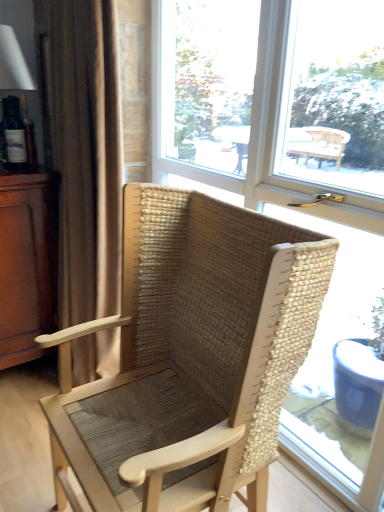
Question: Is transparent glass window at center surrounded by brown fabric curtain at left?

Choices:
 (A) no
 (B) yes

Answer: (A)

Question: Does brown fabric curtain at left have a greater width compared to transparent glass window at center?

Choices:
 (A) no
 (B) yes

Answer: (B)

Question: From a real-world perspective, is brown fabric curtain at left under transparent glass window at center?

Choices:
 (A) yes
 (B) no

Answer: (A)

Question: Considering the relative sizes of brown fabric curtain at left and transparent glass window at center in the image provided, is brown fabric curtain at left bigger than transparent glass window at center?

Choices:
 (A) no
 (B) yes

Answer: (A)

Question: Does brown fabric curtain at left have a greater height compared to transparent glass window at center?

Choices:
 (A) yes
 (B) no

Answer: (A)

Question: Does point (49, 313) appear closer or farther from the camera than point (274, 209)?

Choices:
 (A) closer
 (B) farther

Answer: (B)

Question: From the image's perspective, is brown wood dresser at left above or below transparent glass window at center?

Choices:
 (A) above
 (B) below

Answer: (B)

Question: Considering the positions of brown wood dresser at left and transparent glass window at center in the image, is brown wood dresser at left bigger or smaller than transparent glass window at center?

Choices:
 (A) small
 (B) big

Answer: (A)

Question: From a real-world perspective, is brown wood dresser at left physically located above or below transparent glass window at center?

Choices:
 (A) above
 (B) below

Answer: (B)

Question: Looking at the image, does natural woven wood chair at center seem bigger or smaller compared to brown wood dresser at left?

Choices:
 (A) big
 (B) small

Answer: (A)

Question: From their relative heights in the image, would you say natural woven wood chair at center is taller or shorter than brown wood dresser at left?

Choices:
 (A) short
 (B) tall

Answer: (B)

Question: In the image, is natural woven wood chair at center positioned in front of or behind brown wood dresser at left?

Choices:
 (A) behind
 (B) front

Answer: (B)

Question: From a real-world perspective, relative to brown wood dresser at left, is natural woven wood chair at center vertically above or below?

Choices:
 (A) above
 (B) below

Answer: (A)

Question: Is natural woven wood chair at center to the left or to the right of transparent glass window at center in the image?

Choices:
 (A) right
 (B) left

Answer: (B)

Question: Is natural woven wood chair at center inside or outside of transparent glass window at center?

Choices:
 (A) outside
 (B) inside

Answer: (A)